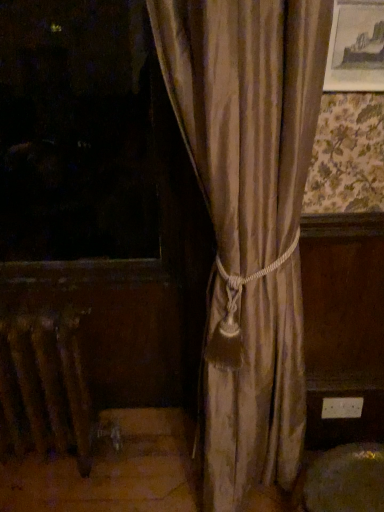
Question: Should I look upward or downward to see metallic radiator at lower left?

Choices:
 (A) up
 (B) down

Answer: (B)

Question: Is metallic radiator at lower left positioned with its back to wooden picture frame at upper right?

Choices:
 (A) no
 (B) yes

Answer: (A)

Question: Considering the relative sizes of metallic radiator at lower left and wooden picture frame at upper right in the image provided, is metallic radiator at lower left wider than wooden picture frame at upper right?

Choices:
 (A) yes
 (B) no

Answer: (A)

Question: Could you tell me if metallic radiator at lower left is facing wooden picture frame at upper right?

Choices:
 (A) no
 (B) yes

Answer: (A)

Question: From the image's perspective, is metallic radiator at lower left over wooden picture frame at upper right?

Choices:
 (A) yes
 (B) no

Answer: (B)

Question: Can you confirm if metallic radiator at lower left is smaller than wooden picture frame at upper right?

Choices:
 (A) yes
 (B) no

Answer: (B)

Question: Does metallic radiator at lower left have a greater height compared to wooden picture frame at upper right?

Choices:
 (A) no
 (B) yes

Answer: (B)

Question: Can you confirm if wooden picture frame at upper right is taller than metallic radiator at lower left?

Choices:
 (A) no
 (B) yes

Answer: (A)

Question: From the image's perspective, is wooden picture frame at upper right below metallic radiator at lower left?

Choices:
 (A) no
 (B) yes

Answer: (A)

Question: Is wooden picture frame at upper right behind metallic radiator at lower left?

Choices:
 (A) yes
 (B) no

Answer: (B)

Question: Can you confirm if wooden picture frame at upper right is shorter than metallic radiator at lower left?

Choices:
 (A) yes
 (B) no

Answer: (A)

Question: Is wooden picture frame at upper right not inside metallic radiator at lower left?

Choices:
 (A) no
 (B) yes

Answer: (B)

Question: Considering the relative sizes of wooden picture frame at upper right and metallic radiator at lower left in the image provided, is wooden picture frame at upper right smaller than metallic radiator at lower left?

Choices:
 (A) yes
 (B) no

Answer: (A)

Question: From a real-world perspective, is wooden picture frame at upper right above or below metallic radiator at lower left?

Choices:
 (A) below
 (B) above

Answer: (B)